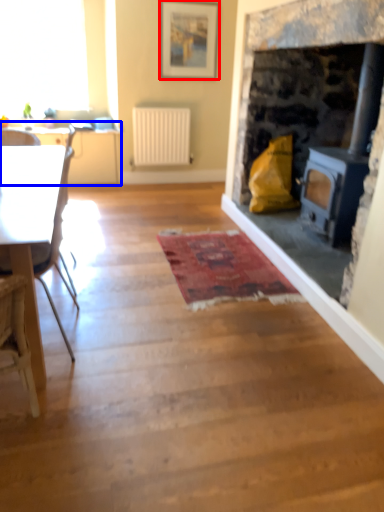
Question: Among these objects, which one is farthest to the camera, picture frame (highlighted by a red box) or table (highlighted by a blue box)?

Choices:
 (A) picture frame
 (B) table

Answer: (B)